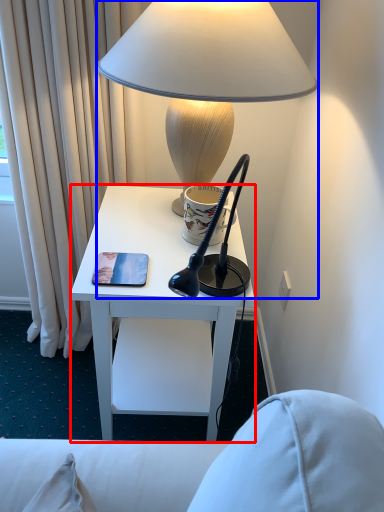
Question: Which of the following is the closest to the observer, desk (highlighted by a red box) or lamp (highlighted by a blue box)?

Choices:
 (A) desk
 (B) lamp

Answer: (B)